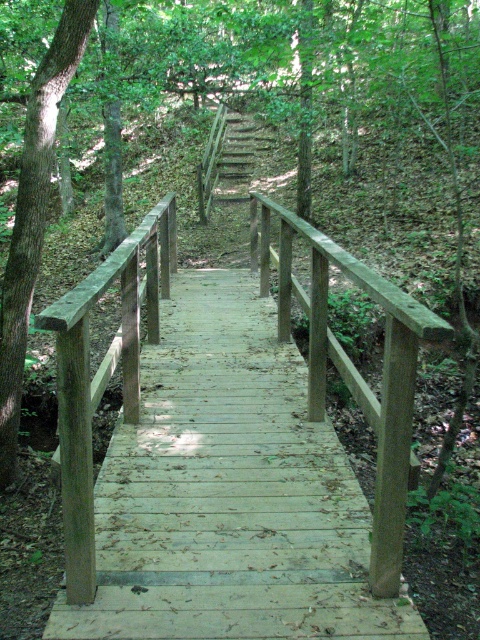
Can you confirm if light brown wooden rail at center is taller than wooden stairs at center?

Indeed, light brown wooden rail at center has a greater height compared to wooden stairs at center.

Is light brown wooden rail at center smaller than wooden stairs at center?

No.

Between point (372, 541) and point (216, 125), which one is positioned behind?

Positioned behind is point (216, 125).

This screenshot has width=480, height=640. What are the coordinates of `light brown wooden rail at center` in the screenshot? It's located at (355, 368).

Is smooth brown tree trunk at left further to camera compared to wooden stairs at center?

No, smooth brown tree trunk at left is in front of wooden stairs at center.

Who is lower down, smooth brown tree trunk at left or wooden stairs at center?

Positioned lower is smooth brown tree trunk at left.

This screenshot has height=640, width=480. What are the coordinates of `smooth brown tree trunk at left` in the screenshot? It's located at click(34, 214).

Between light brown wooden rail at center and smooth brown tree trunk at left, which one appears on the right side from the viewer's perspective?

light brown wooden rail at center is more to the right.

Between point (385, 492) and point (0, 481), which one is positioned in front?

Point (385, 492)

At what (x,y) coordinates should I click in order to perform the action: click on light brown wooden rail at center. Please return your answer as a coordinate pair (x, y). Looking at the image, I should click on (355, 368).